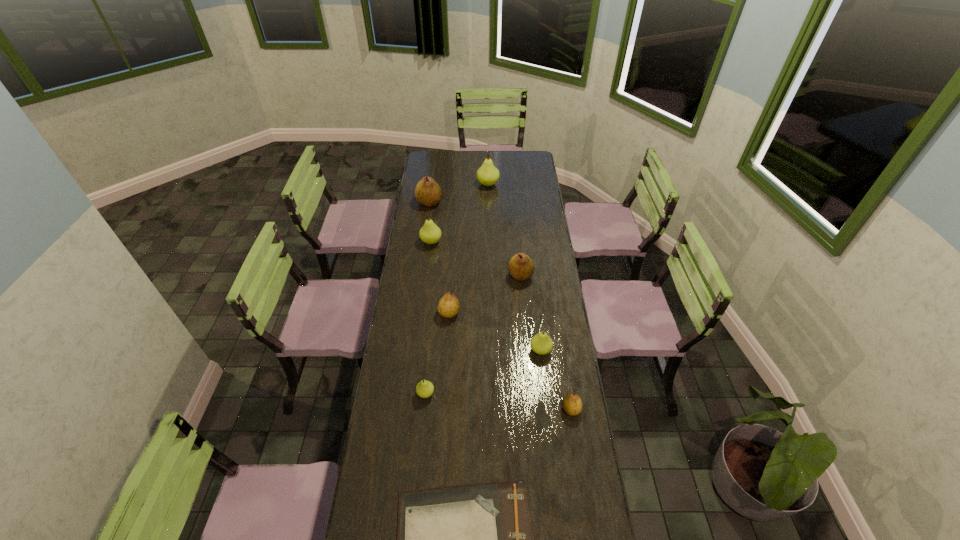
Locate an element on the screen. The image size is (960, 540). the farthest green pear is located at coordinates (487, 174).

You are a GUI agent. You are given a task and a screenshot of the screen. Output one action in this format:
    pyautogui.click(x=<x>, y=<y>)
    Task: Click on the biggest green pear
    This screenshot has width=960, height=540.
    Given the screenshot: What is the action you would take?
    pyautogui.click(x=487, y=174)

At what (x,y) coordinates should I click in order to perform the action: click on the farthest brown pear. Please return your answer as a coordinate pair (x, y). Image resolution: width=960 pixels, height=540 pixels. Looking at the image, I should click on (427, 192).

The height and width of the screenshot is (540, 960). Identify the location of the biggest brown pear. (427, 192).

Find the location of a particular element. The width and height of the screenshot is (960, 540). the third nearest green pear is located at coordinates (430, 233).

Where is `the second biggest green pear`? the second biggest green pear is located at coordinates (430, 233).

The height and width of the screenshot is (540, 960). Identify the location of the third brown pear from left to right. (521, 268).

At what (x,y) coordinates should I click in order to perform the action: click on the fifth nearest pear. Please return your answer as a coordinate pair (x, y). This screenshot has width=960, height=540. Looking at the image, I should click on (521, 268).

At what (x,y) coordinates should I click in order to perform the action: click on the fifth farthest object. Please return your answer as a coordinate pair (x, y). Looking at the image, I should click on (448, 306).

At what (x,y) coordinates should I click in order to perform the action: click on the second brown pear from left to right. Please return your answer as a coordinate pair (x, y). The width and height of the screenshot is (960, 540). Looking at the image, I should click on (448, 306).